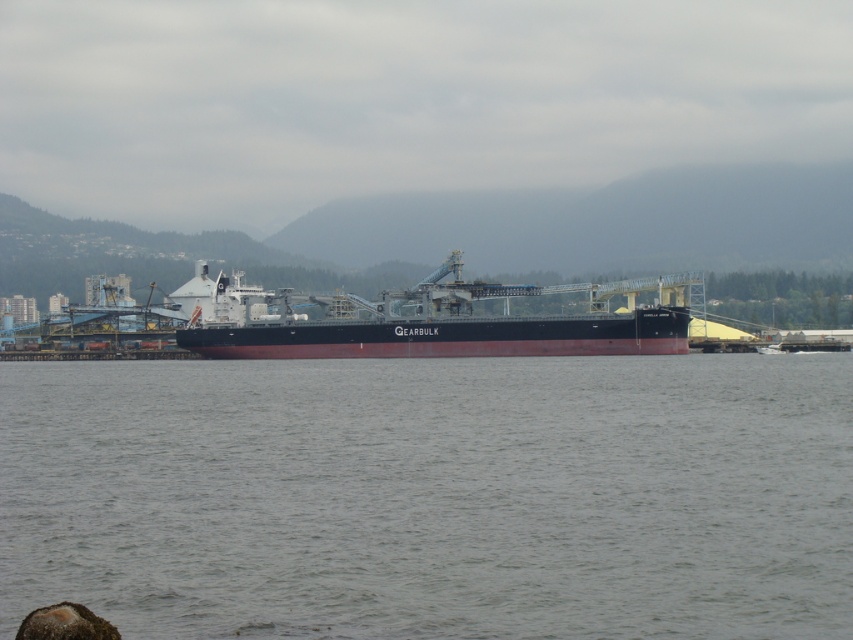
Question: In this image, where is gray water at center located relative to black matte cargo ship at center?

Choices:
 (A) right
 (B) left

Answer: (A)

Question: Which of the following is the farthest from the observer?

Choices:
 (A) black matte cargo ship at center
 (B) gray water at center

Answer: (A)

Question: Which of the following is the farthest from the observer?

Choices:
 (A) gray water at center
 (B) black matte cargo ship at center

Answer: (B)

Question: Does gray water at center have a lesser width compared to black matte cargo ship at center?

Choices:
 (A) no
 (B) yes

Answer: (A)

Question: Is gray water at center closer to the viewer compared to black matte cargo ship at center?

Choices:
 (A) yes
 (B) no

Answer: (A)